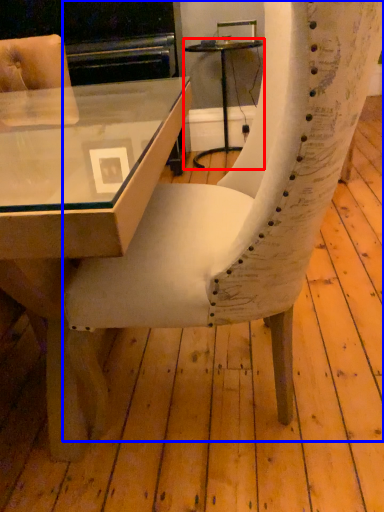
Question: Which object appears farthest to the camera in this image, table (highlighted by a red box) or chair (highlighted by a blue box)?

Choices:
 (A) table
 (B) chair

Answer: (A)